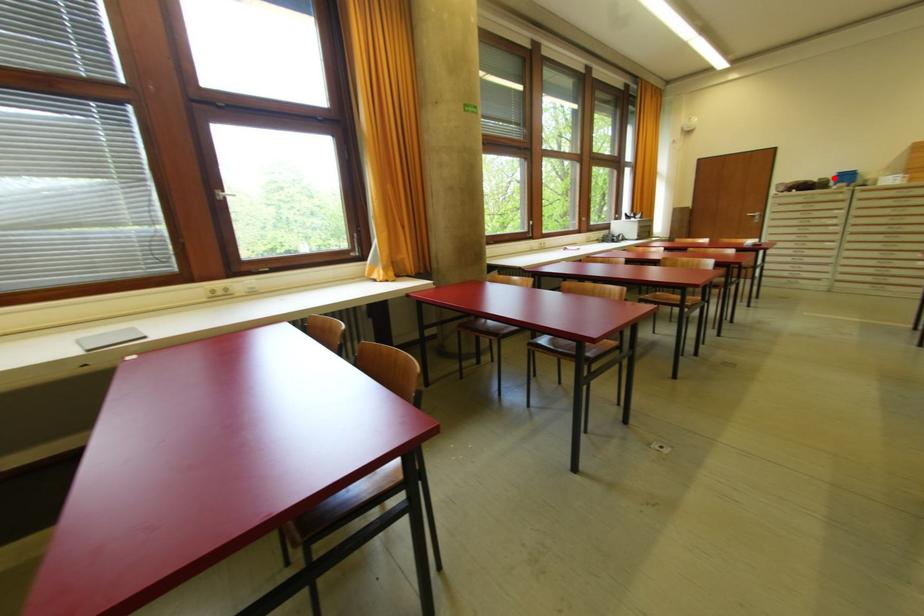
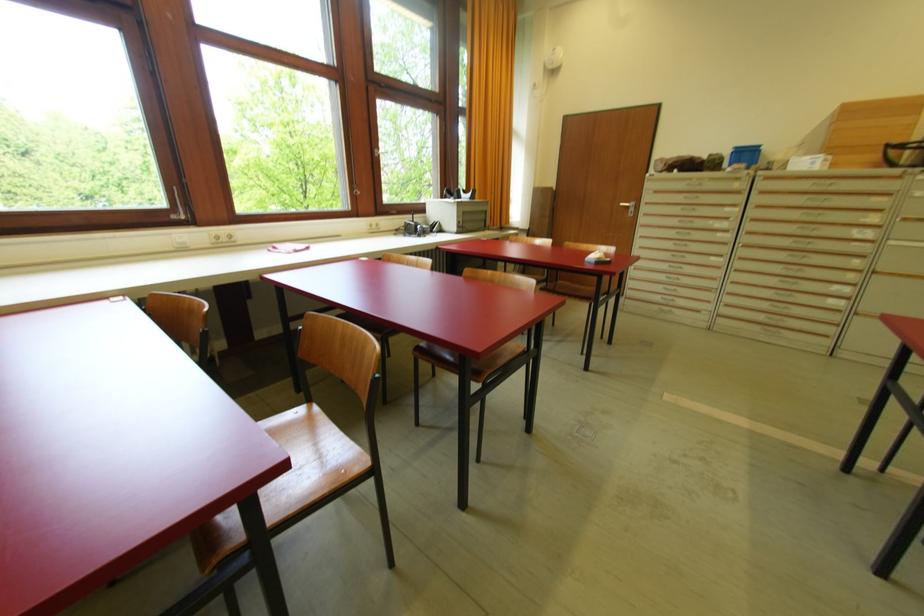
In the second image, find the point that corresponds to the highlighted location in the first image.

(728, 155)